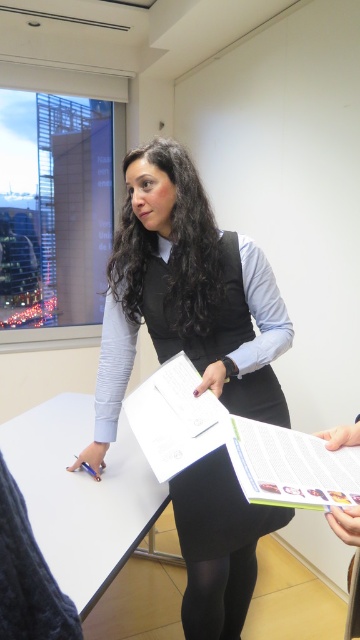
Describe the element at coordinates (186, 298) in the screenshot. The width and height of the screenshot is (360, 640). I see `matte black vest at center` at that location.

Can you confirm if matte black vest at center is thinner than white matte table at center?

No, matte black vest at center is not thinner than white matte table at center.

Looking at this image, measure the distance between matte black vest at center and camera.

matte black vest at center and camera are 1.32 meters apart from each other.

Where is `matte black vest at center`? matte black vest at center is located at coordinates (186, 298).